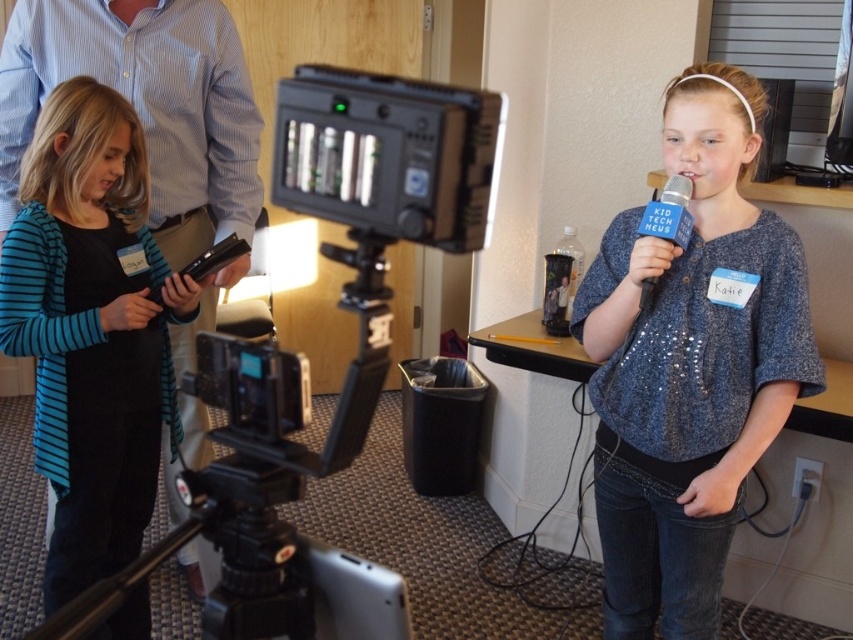
Who is more forward, (415, 195) or (791, 333)?

Point (415, 195) is in front.

Which of these two, black plastic video camera at center or sparkly blue blouse at center, stands taller?

Standing taller between the two is sparkly blue blouse at center.

Is point (437, 140) farther from camera compared to point (657, 614)?

No.

Where is `black plastic video camera at center`? This screenshot has height=640, width=853. black plastic video camera at center is located at coordinates (306, 360).

Which is above, sparkly blue blouse at center or blue fabric microphone at center?

blue fabric microphone at center is higher up.

Is point (689, 308) in front of point (668, 182)?

No, (689, 308) is behind (668, 182).

The height and width of the screenshot is (640, 853). I want to click on sparkly blue blouse at center, so coord(689,364).

Which is above, blue striped cardigan at left or blue fabric microphone at center?

blue fabric microphone at center

Is blue striped cardigan at left bigger than blue fabric microphone at center?

Indeed, blue striped cardigan at left has a larger size compared to blue fabric microphone at center.

Does point (49, 548) lie behind point (662, 230)?

Yes, point (49, 548) is farther from viewer.

Where is `blue striped cardigan at left`? This screenshot has height=640, width=853. blue striped cardigan at left is located at coordinates (91, 330).